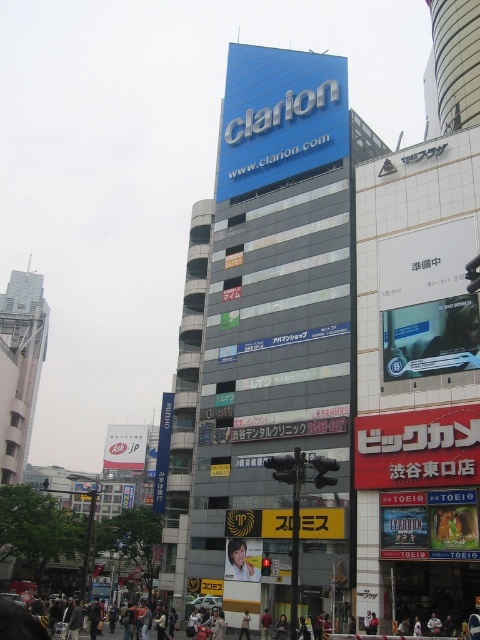
You are standing in the middle of the street looking at the tall building with the Clarion sign. There is a point at coordinates (x=279, y=116). Where exactly is this point located?

The point at coordinates (x=279, y=116) is located on the blue glossy sign at upper center of the Clarion building.

You are standing in front of the Clarion building and notice two objects in the scene. One is the blue glossy sign at upper center and the other is the smooth plastic face at center. From your perspective, which object is positioned to the right?

The blue glossy sign at upper center is to the right of the smooth plastic face at center.